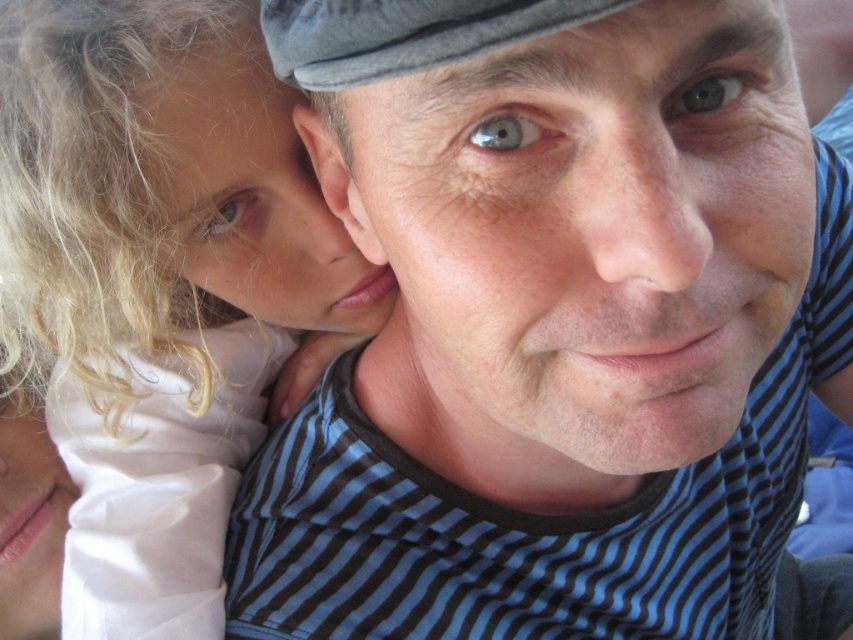
Question: Is blue striped shirt at center closer to camera compared to white satin dress at left?

Choices:
 (A) yes
 (B) no

Answer: (A)

Question: Is blue striped shirt at center wider than white satin dress at left?

Choices:
 (A) no
 (B) yes

Answer: (B)

Question: Can you confirm if blue striped shirt at center is bigger than white satin dress at left?

Choices:
 (A) no
 (B) yes

Answer: (B)

Question: Which point is closer to the camera taking this photo?

Choices:
 (A) (463, 134)
 (B) (62, 106)

Answer: (A)

Question: Which point is closer to the camera?

Choices:
 (A) white satin dress at left
 (B) blue striped shirt at center

Answer: (B)